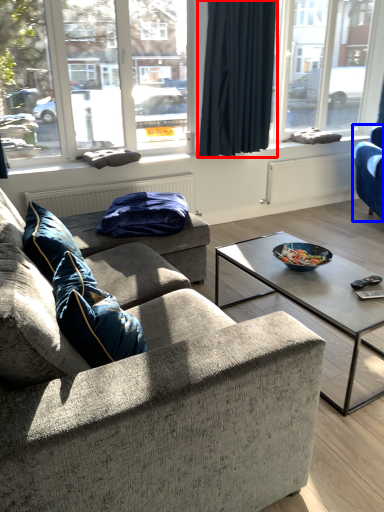
Question: Which object is further to the camera taking this photo, curtain (highlighted by a red box) or studio couch (highlighted by a blue box)?

Choices:
 (A) curtain
 (B) studio couch

Answer: (B)